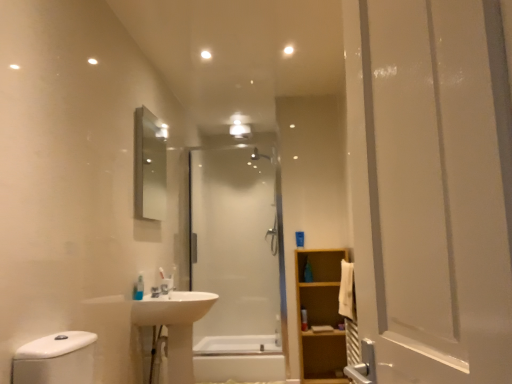
Question: From the image's perspective, is white glossy sink at lower center located beneath light brown wooden cabinet at right?

Choices:
 (A) yes
 (B) no

Answer: (B)

Question: From a real-world perspective, does white glossy sink at lower center sit lower than light brown wooden cabinet at right?

Choices:
 (A) yes
 (B) no

Answer: (B)

Question: Could you tell me if white glossy sink at lower center is facing light brown wooden cabinet at right?

Choices:
 (A) yes
 (B) no

Answer: (B)

Question: Is white glossy sink at lower center positioned far away from light brown wooden cabinet at right?

Choices:
 (A) yes
 (B) no

Answer: (A)

Question: Does white glossy sink at lower center have a lesser height compared to light brown wooden cabinet at right?

Choices:
 (A) no
 (B) yes

Answer: (B)

Question: From their relative heights in the image, would you say white glossy sink at center is taller or shorter than translucent plastic bottle at center, the 1th toiletry in the right-to-left sequence?

Choices:
 (A) tall
 (B) short

Answer: (A)

Question: Is white glossy sink at center bigger or smaller than translucent plastic bottle at center, the 1th toiletry positioned from the back?

Choices:
 (A) small
 (B) big

Answer: (B)

Question: Visually, is white glossy sink at center positioned to the left or to the right of translucent plastic bottle at center, the 1th toiletry positioned from the back?

Choices:
 (A) right
 (B) left

Answer: (B)

Question: Is white glossy sink at center situated inside translucent plastic bottle at center, which is the 2th toiletry in left-to-right order, or outside?

Choices:
 (A) inside
 (B) outside

Answer: (B)

Question: From a real-world perspective, is silver metallic mirror at upper left above or below translucent plastic soap dispenser at lower left, positioned as the first toiletry in top-to-bottom order?

Choices:
 (A) above
 (B) below

Answer: (A)

Question: Considering the relative positions of silver metallic mirror at upper left and translucent plastic soap dispenser at lower left, placed as the second toiletry when sorted from bottom to top, in the image provided, is silver metallic mirror at upper left to the left or to the right of translucent plastic soap dispenser at lower left, placed as the second toiletry when sorted from bottom to top,?

Choices:
 (A) left
 (B) right

Answer: (A)

Question: Based on their sizes in the image, would you say silver metallic mirror at upper left is bigger or smaller than translucent plastic soap dispenser at lower left, the second toiletry positioned from the right?

Choices:
 (A) big
 (B) small

Answer: (A)

Question: Considering the positions of silver metallic mirror at upper left and translucent plastic soap dispenser at lower left, placed as the second toiletry when sorted from bottom to top, in the image, is silver metallic mirror at upper left taller or shorter than translucent plastic soap dispenser at lower left, placed as the second toiletry when sorted from bottom to top,?

Choices:
 (A) tall
 (B) short

Answer: (A)

Question: In terms of width, does white glossy sink at center look wider or thinner when compared to white glossy bathtub at center?

Choices:
 (A) wide
 (B) thin

Answer: (B)

Question: From a real-world perspective, is white glossy sink at center above or below white glossy bathtub at center?

Choices:
 (A) above
 (B) below

Answer: (A)